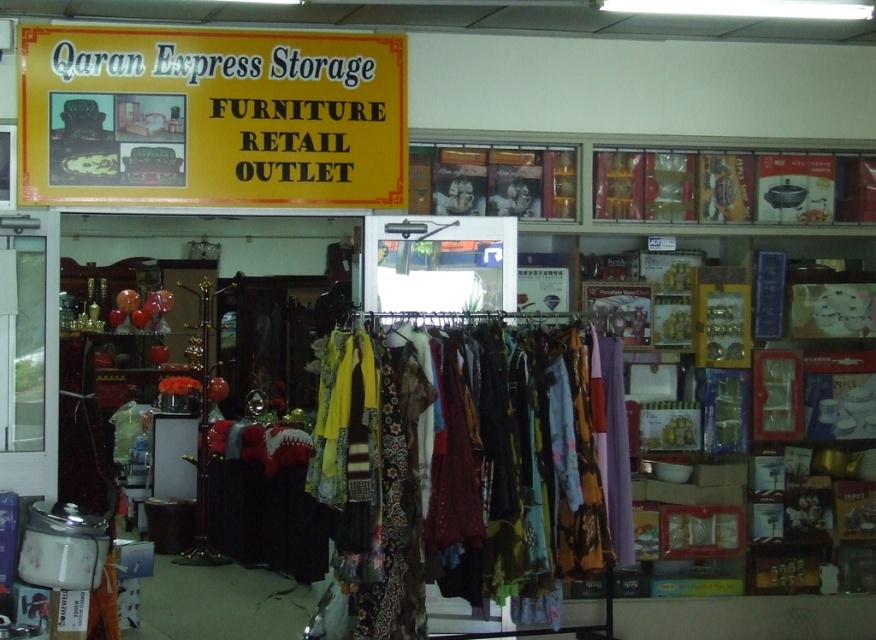
Question: Which point is closer to the camera?

Choices:
 (A) (400, 609)
 (B) (359, 131)

Answer: (A)

Question: Can you confirm if multicolored fabric dress at center is positioned to the right of yellow paper sign at upper center?

Choices:
 (A) yes
 (B) no

Answer: (A)

Question: Is multicolored fabric dress at center thinner than yellow paper sign at upper center?

Choices:
 (A) yes
 (B) no

Answer: (A)

Question: Which point is closer to the camera?

Choices:
 (A) (203, 88)
 (B) (521, 470)

Answer: (B)

Question: Observing the image, what is the correct spatial positioning of multicolored fabric dress at center in reference to yellow paper sign at upper center?

Choices:
 (A) left
 (B) right

Answer: (B)